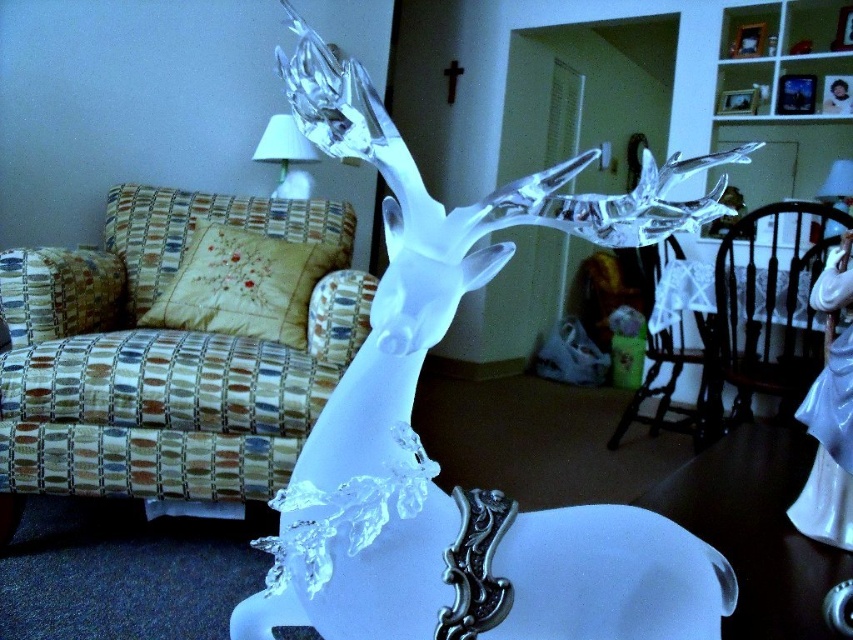
Question: Does white frosted glass deer at center have a smaller size compared to white glass lampshade at upper center?

Choices:
 (A) yes
 (B) no

Answer: (B)

Question: Which point is closer to the camera?

Choices:
 (A) (283, 186)
 (B) (374, 573)

Answer: (B)

Question: Is white frosted glass deer at center positioned before white glass lampshade at upper center?

Choices:
 (A) no
 (B) yes

Answer: (B)

Question: Can you confirm if white frosted glass deer at center is positioned to the right of white glass lampshade at upper center?

Choices:
 (A) yes
 (B) no

Answer: (A)